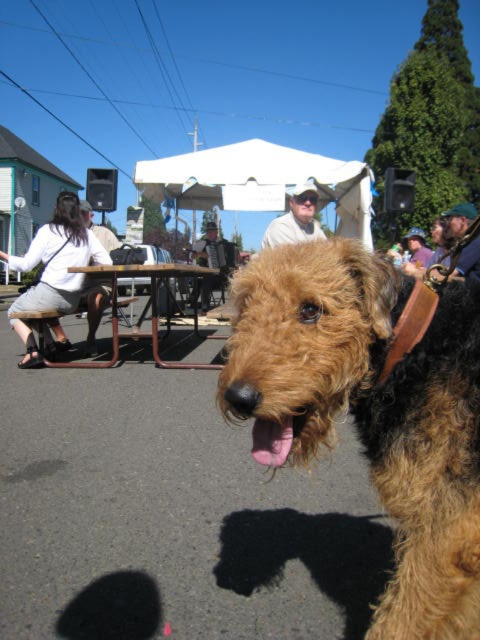
You are organizing a pet show and need to ensure that the brown furry dog at center can comfortably stand next to the white shirt at upper left without overlapping. Based on their sizes, is this arrangement feasible?

The brown furry dog at center might be wider than the white shirt at upper left, so there could be a risk of overlapping if placed side by side. Ensure sufficient spacing between them to avoid overlap.

Based on the scene description, where is the white cotton shirt at left located in terms of its 2D coordinates?

The white cotton shirt at left is located at the 2D coordinates of point (x=54, y=269).

You are standing at the edge of the event area and see both the white cotton shirt at left and the matte purple shirt at center. Which shirt is nearer to you?

The white cotton shirt at left is closer to the viewer than the matte purple shirt at center, so the white cotton shirt at left is nearer to you.